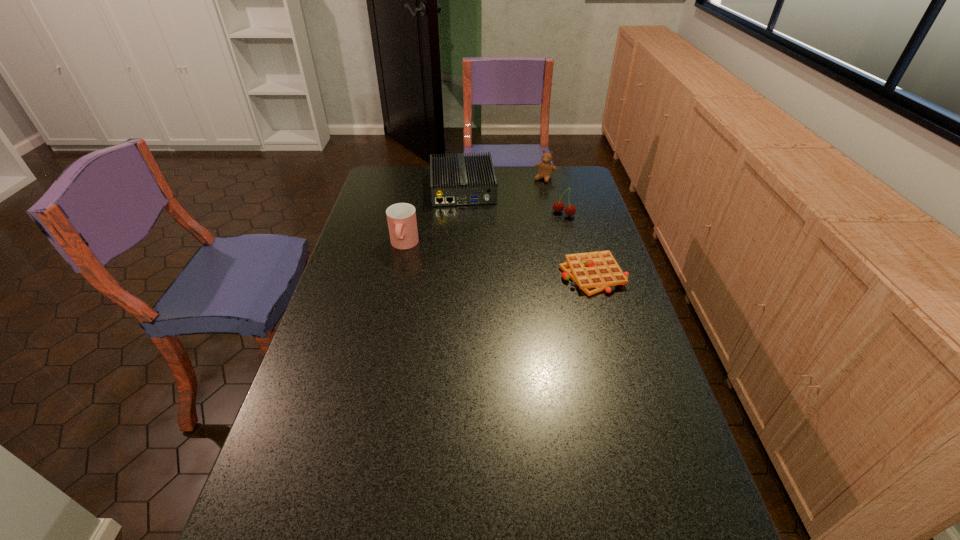
Locate an element on the screen. This screenshot has height=540, width=960. vacant point that satisfies the following two spatial constraints: 1. on the side of the waffle with the handle; 2. on the right side of the leftmost object is located at coordinates (397, 275).

At what (x,y) coordinates should I click in order to perform the action: click on free location that satisfies the following two spatial constraints: 1. on the back side of the teddy bear; 2. on the right side of the fourth object from right to left. Please return your answer as a coordinate pair (x, y). The height and width of the screenshot is (540, 960). Looking at the image, I should click on (464, 179).

At what (x,y) coordinates should I click in order to perform the action: click on vacant point that satisfies the following two spatial constraints: 1. on the side of the cup with the handle; 2. on the left side of the shortest object. Please return your answer as a coordinate pair (x, y). The height and width of the screenshot is (540, 960). Looking at the image, I should click on (397, 275).

This screenshot has width=960, height=540. In order to click on free space in the image that satisfies the following two spatial constraints: 1. on the side of the leftmost object with the handle; 2. on the left side of the waffle in this screenshot , I will do `click(397, 275)`.